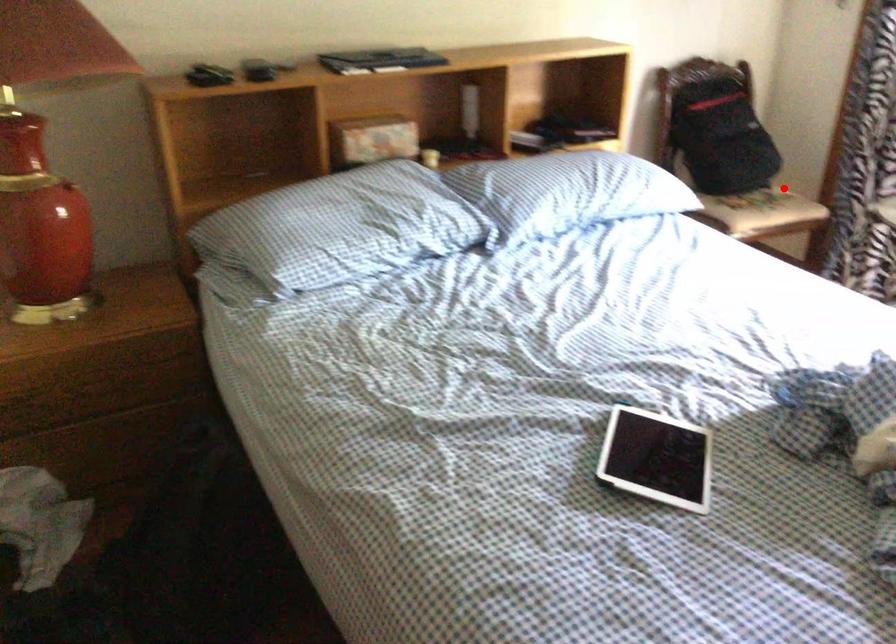
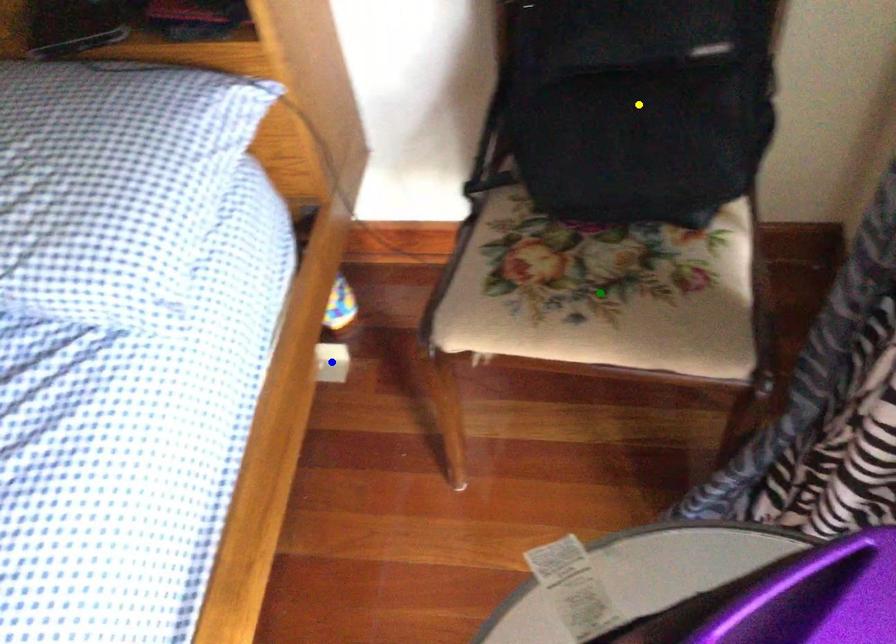
Question: I am providing you with two images of the same scene from different viewpoints. A red point is marked on the first image. You are given multiple points on the second image. Which mark in image 2 goes with the point in image 1?

Choices:
 (A) green point
 (B) blue point
 (C) yellow point

Answer: (A)